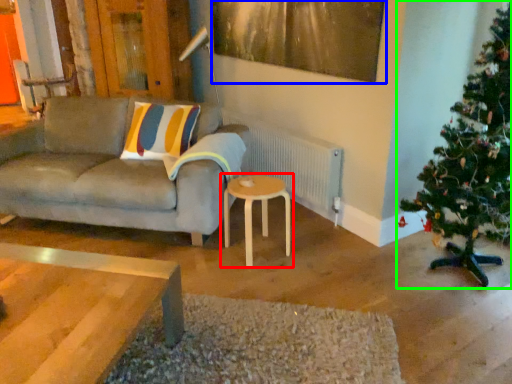
Question: Which is farther away from table (highlighted by a red box)? picture frame (highlighted by a blue box) or christmas tree (highlighted by a green box)?

Choices:
 (A) picture frame
 (B) christmas tree

Answer: (A)